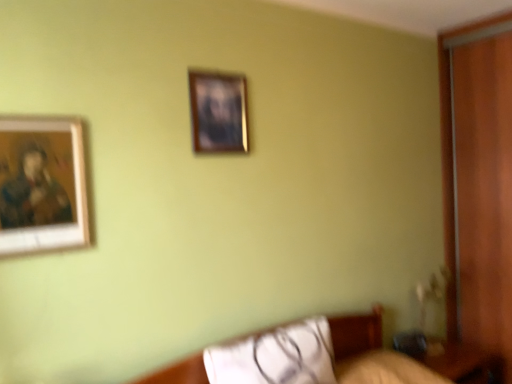
Question: Considering the relative sizes of white fabric pillow at lower center and wooden frame at upper center, marked as the 2th picture frame in a left-to-right arrangement, in the image provided, is white fabric pillow at lower center thinner than wooden frame at upper center, marked as the 2th picture frame in a left-to-right arrangement,?

Choices:
 (A) yes
 (B) no

Answer: (B)

Question: Can you confirm if white fabric pillow at lower center is wider than wooden frame at upper center, which appears as the 1th picture frame when viewed from the right?

Choices:
 (A) yes
 (B) no

Answer: (A)

Question: Is white fabric pillow at lower center positioned behind wooden frame at upper center, which appears as the 1th picture frame when viewed from the right?

Choices:
 (A) yes
 (B) no

Answer: (B)

Question: Is white fabric pillow at lower center facing away from wooden frame at upper center, arranged as the second picture frame when ordered from the bottom?

Choices:
 (A) no
 (B) yes

Answer: (A)

Question: Is white fabric pillow at lower center not close to wooden frame at upper center, the second picture frame from the front?

Choices:
 (A) no
 (B) yes

Answer: (B)

Question: From the image's perspective, is white fabric pillow at lower center above or below wooden table at lower right?

Choices:
 (A) below
 (B) above

Answer: (B)

Question: Is white fabric pillow at lower center taller or shorter than wooden table at lower right?

Choices:
 (A) tall
 (B) short

Answer: (B)

Question: Relative to wooden table at lower right, is white fabric pillow at lower center in front or behind?

Choices:
 (A) front
 (B) behind

Answer: (A)

Question: Does point (260, 382) appear closer or farther from the camera than point (494, 354)?

Choices:
 (A) farther
 (B) closer

Answer: (B)

Question: Visually, is wooden frame at upper center, the second picture frame from the front, positioned to the left or to the right of white fabric pillow at lower center?

Choices:
 (A) left
 (B) right

Answer: (A)

Question: Which is correct: wooden frame at upper center, which is the first picture frame from top to bottom, is inside white fabric pillow at lower center, or outside of it?

Choices:
 (A) outside
 (B) inside

Answer: (A)

Question: Considering their positions, is wooden frame at upper center, marked as the 2th picture frame in a left-to-right arrangement, located in front of or behind white fabric pillow at lower center?

Choices:
 (A) behind
 (B) front

Answer: (A)

Question: Is wooden frame at upper center, which is the first picture frame from top to bottom, wider or thinner than white fabric pillow at lower center?

Choices:
 (A) wide
 (B) thin

Answer: (B)

Question: From a real-world perspective, relative to white fabric pillow at lower center, is wooden-framed painting at left, marked as the first picture frame in a left-to-right arrangement, vertically above or below?

Choices:
 (A) below
 (B) above

Answer: (B)

Question: Is wooden-framed painting at left, marked as the first picture frame in a left-to-right arrangement, in front of or behind white fabric pillow at lower center in the image?

Choices:
 (A) front
 (B) behind

Answer: (A)